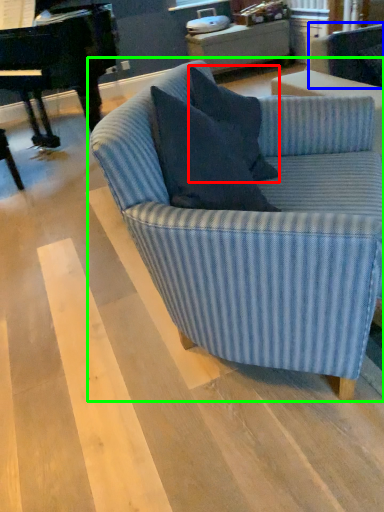
Question: Estimate the real-world distances between objects in this image. Which object is farther from pillow (highlighted by a red box), swivel chair (highlighted by a blue box) or studio couch (highlighted by a green box)?

Choices:
 (A) swivel chair
 (B) studio couch

Answer: (A)